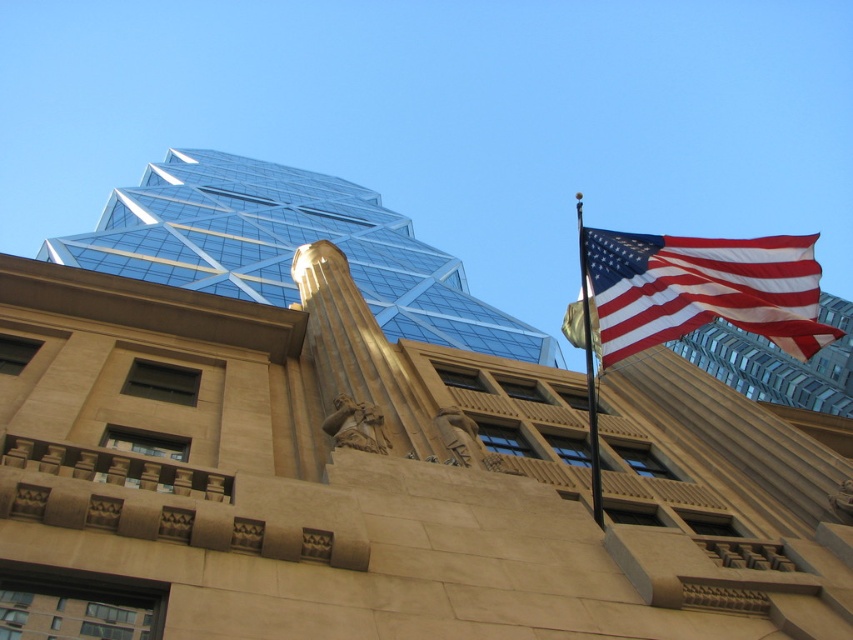
You are an architect analyzing the image of the historic building and modern skyscraper. You notice a point at coordinates (360, 353). What architectural element is located at that point?

The point at coordinates (360, 353) is occupied by the beige stone column at center.